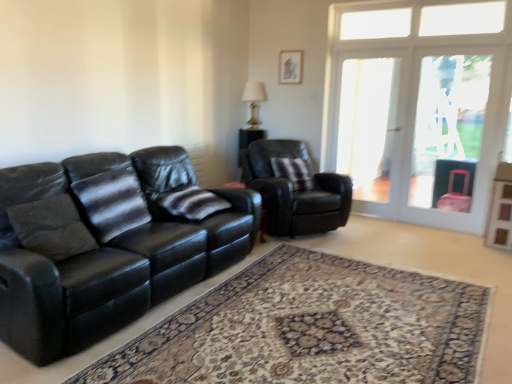
Question: Can you confirm if striped fabric pillow at center, which is the 2th pillow in right-to-left order, is shorter than carpeted rug at center?

Choices:
 (A) yes
 (B) no

Answer: (B)

Question: Can you confirm if striped fabric pillow at center, placed as the second pillow when sorted from front to back, is smaller than carpeted rug at center?

Choices:
 (A) yes
 (B) no

Answer: (A)

Question: Is striped fabric pillow at center, the 2th pillow viewed from the left, facing away from carpeted rug at center?

Choices:
 (A) yes
 (B) no

Answer: (B)

Question: Would you say striped fabric pillow at center, the 2th pillow positioned from the back, is outside carpeted rug at center?

Choices:
 (A) no
 (B) yes

Answer: (B)

Question: Is striped fabric pillow at center, which is the 2th pillow in right-to-left order, in contact with carpeted rug at center?

Choices:
 (A) yes
 (B) no

Answer: (B)

Question: From the image's perspective, is black leather armchair at center located above or below clear glass screen door at right, acting as the 2th screen door starting from the left?

Choices:
 (A) below
 (B) above

Answer: (A)

Question: Is black leather armchair at center wider or thinner than clear glass screen door at right, which appears as the 1th screen door when viewed from the right?

Choices:
 (A) thin
 (B) wide

Answer: (B)

Question: Is point (282, 192) closer or farther from the camera than point (414, 195)?

Choices:
 (A) closer
 (B) farther

Answer: (A)

Question: Is black leather armchair at center bigger or smaller than clear glass screen door at right, acting as the 2th screen door starting from the left?

Choices:
 (A) big
 (B) small

Answer: (A)

Question: From a real-world perspective, is clear glass screen door at right, acting as the 2th screen door starting from the left, physically located above or below striped fabric pillow at left, which is the third pillow in right-to-left order?

Choices:
 (A) below
 (B) above

Answer: (B)

Question: From the image's perspective, is clear glass screen door at right, which appears as the 1th screen door when viewed from the right, positioned above or below striped fabric pillow at left, placed as the first pillow when sorted from front to back?

Choices:
 (A) below
 (B) above

Answer: (B)

Question: In terms of height, does clear glass screen door at right, which appears as the 1th screen door when viewed from the right, look taller or shorter compared to striped fabric pillow at left, the 3th pillow when ordered from back to front?

Choices:
 (A) short
 (B) tall

Answer: (B)

Question: Is clear glass screen door at right, acting as the 2th screen door starting from the left, inside or outside of striped fabric pillow at left, the 3th pillow when ordered from back to front?

Choices:
 (A) outside
 (B) inside

Answer: (A)

Question: Based on their positions, is striped fabric pillow at center, the 2th pillow viewed from the left, located to the left or right of striped fabric pillow at center, the 3th pillow viewed from the front?

Choices:
 (A) right
 (B) left

Answer: (B)

Question: Is striped fabric pillow at center, the 2th pillow positioned from the back, inside the boundaries of striped fabric pillow at center, which appears as the 1th pillow when viewed from the back, or outside?

Choices:
 (A) inside
 (B) outside

Answer: (B)